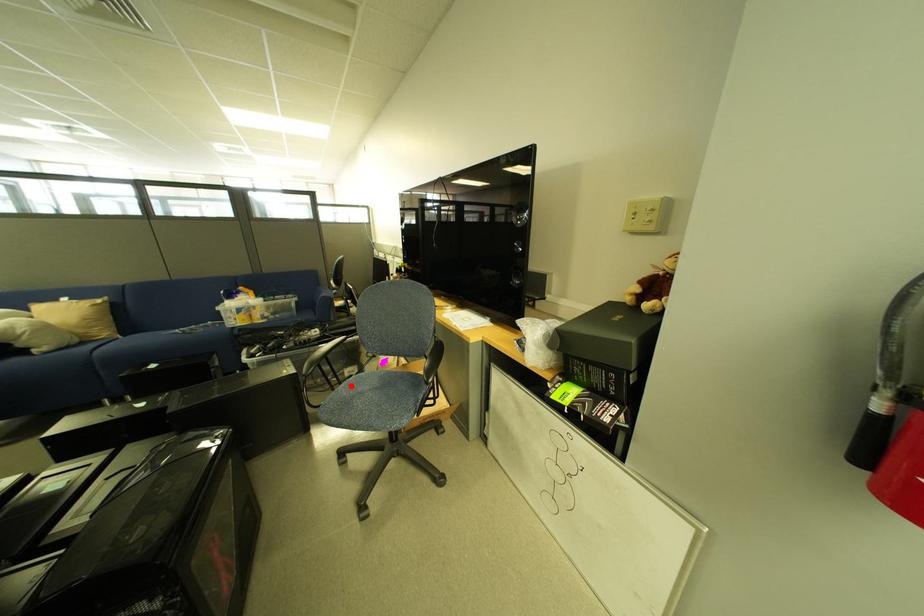
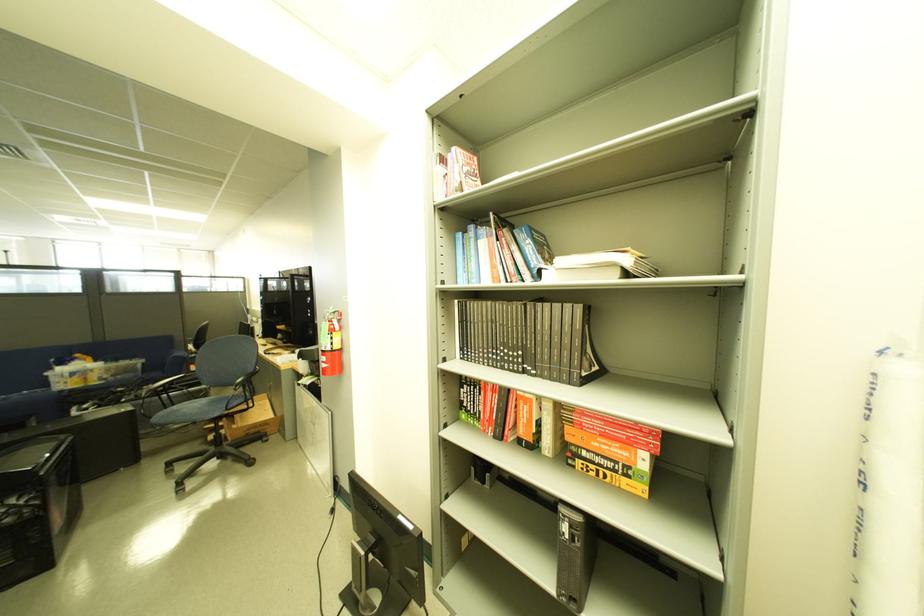
Find the pixel in the second image that matches the highlighted location in the first image.

(185, 408)